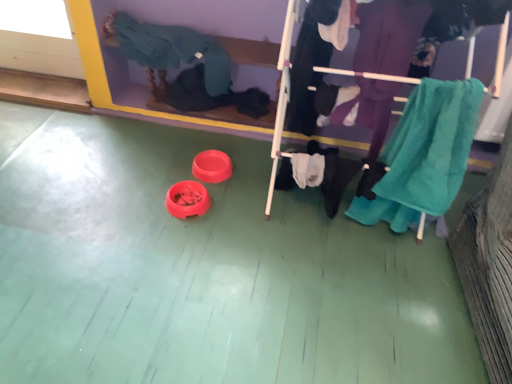
The width and height of the screenshot is (512, 384). I want to click on free location to the left of black cotton pants at center, which is counted as the 2th clothing, starting from the left, so click(243, 213).